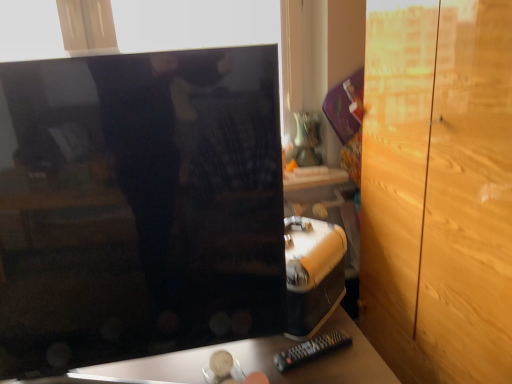
Question: From a real-world perspective, is glossy black monitor at center located beneath black plastic remote at lower center?

Choices:
 (A) yes
 (B) no

Answer: (B)

Question: Can you confirm if glossy black monitor at center is positioned to the left of black plastic remote at lower center?

Choices:
 (A) yes
 (B) no

Answer: (A)

Question: Is glossy black monitor at center positioned with its back to black plastic remote at lower center?

Choices:
 (A) yes
 (B) no

Answer: (B)

Question: Could you tell me if glossy black monitor at center is facing black plastic remote at lower center?

Choices:
 (A) no
 (B) yes

Answer: (A)

Question: Is black plastic remote at lower center inside glossy black monitor at center?

Choices:
 (A) yes
 (B) no

Answer: (B)

Question: Is glossy black monitor at center touching black plastic remote at lower center?

Choices:
 (A) no
 (B) yes

Answer: (A)

Question: Does light brown wood dresser at right have a smaller size compared to matte black tv at center?

Choices:
 (A) no
 (B) yes

Answer: (A)

Question: From the image's perspective, does light brown wood dresser at right appear lower than matte black tv at center?

Choices:
 (A) no
 (B) yes

Answer: (A)

Question: Can you confirm if light brown wood dresser at right is thinner than matte black tv at center?

Choices:
 (A) yes
 (B) no

Answer: (A)

Question: Does light brown wood dresser at right turn towards matte black tv at center?

Choices:
 (A) no
 (B) yes

Answer: (B)

Question: Does light brown wood dresser at right have a larger size compared to matte black tv at center?

Choices:
 (A) yes
 (B) no

Answer: (A)

Question: From a real-world perspective, does light brown wood dresser at right sit lower than matte black tv at center?

Choices:
 (A) yes
 (B) no

Answer: (B)

Question: Does black plastic remote at lower center have a lesser width compared to light brown wood dresser at right?

Choices:
 (A) yes
 (B) no

Answer: (A)